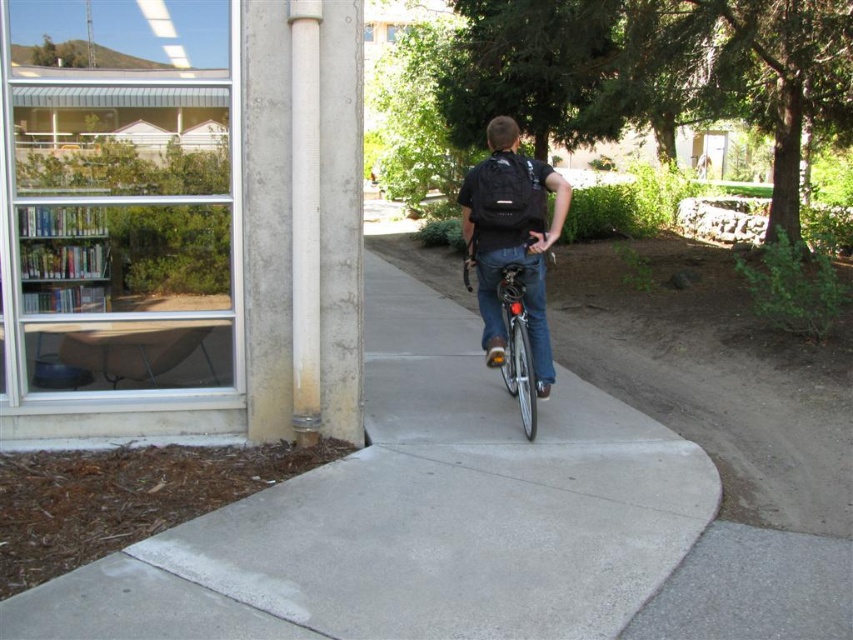
Does white smooth pipe at center have a lesser width compared to metallic silver bookshelf at upper left?

Indeed, white smooth pipe at center has a lesser width compared to metallic silver bookshelf at upper left.

Does white smooth pipe at center have a lesser height compared to metallic silver bookshelf at upper left?

No.

This screenshot has height=640, width=853. I want to click on white smooth pipe at center, so click(x=305, y=218).

Who is shorter, black matte backpack at center or white smooth pipe at center?

black matte backpack at center

Between point (474, 182) and point (318, 236), which one is positioned in front?

Positioned in front is point (318, 236).

Find the location of a particular element. The height and width of the screenshot is (640, 853). black matte backpack at center is located at coordinates (512, 237).

Does metallic silver bookshelf at upper left appear on the left side of shiny metallic bicycle at center?

Indeed, metallic silver bookshelf at upper left is positioned on the left side of shiny metallic bicycle at center.

Looking at this image, can you confirm if metallic silver bookshelf at upper left is taller than shiny metallic bicycle at center?

In fact, metallic silver bookshelf at upper left may be shorter than shiny metallic bicycle at center.

Between point (105, 216) and point (506, 358), which one is positioned in front?

Positioned in front is point (105, 216).

Find the location of a particular element. metallic silver bookshelf at upper left is located at coordinates (62, 259).